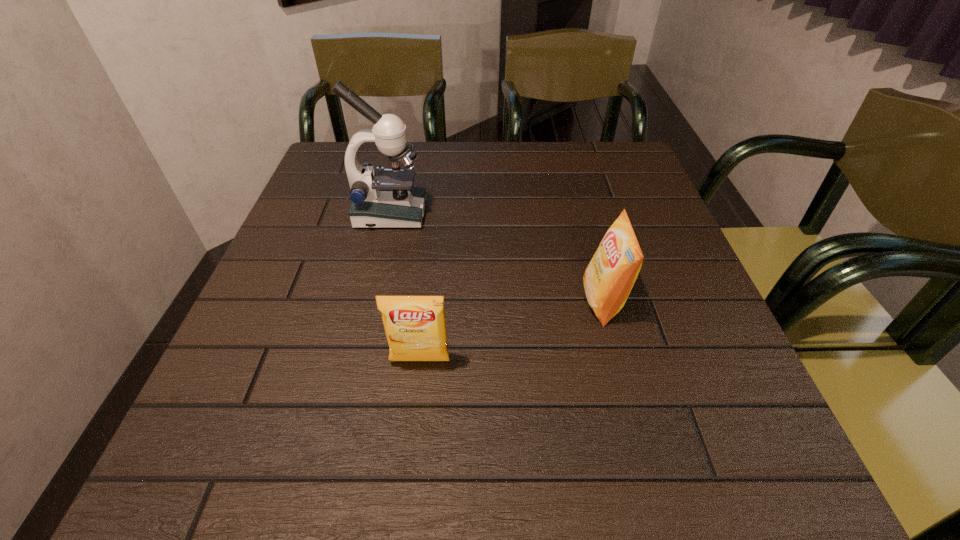
The image size is (960, 540). In order to click on free space between the left crisp (potato chip) and the rightmost object in this screenshot , I will do `click(512, 331)`.

Where is `unoccupied position between the microscope and the nearest object`? unoccupied position between the microscope and the nearest object is located at coordinates (405, 287).

In order to click on empty location between the tallest object and the nearer crisp (potato chip) in this screenshot , I will do `click(405, 287)`.

Identify the location of vacant space that's between the tallest object and the farther crisp (potato chip). (496, 258).

Where is `empty space that is in between the second farthest object and the nearer crisp (potato chip)`? empty space that is in between the second farthest object and the nearer crisp (potato chip) is located at coordinates (512, 331).

Where is `free point between the left crisp (potato chip) and the microscope`? free point between the left crisp (potato chip) and the microscope is located at coordinates (405, 287).

Locate an element on the screen. The height and width of the screenshot is (540, 960). empty space that is in between the farther crisp (potato chip) and the nearest object is located at coordinates [512, 331].

In order to click on vacant area that lies between the right crisp (potato chip) and the microscope in this screenshot , I will do `click(496, 258)`.

Find the location of a particular element. free spot between the second farthest object and the farthest object is located at coordinates (496, 258).

Where is `blank region between the second farthest object and the left crisp (potato chip)`? blank region between the second farthest object and the left crisp (potato chip) is located at coordinates (512, 331).